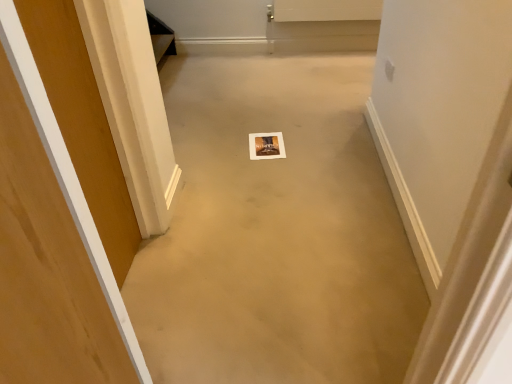
Question: Does beige carpet at center have a larger size compared to wooden door at left?

Choices:
 (A) yes
 (B) no

Answer: (A)

Question: Does beige carpet at center touch wooden door at left?

Choices:
 (A) no
 (B) yes

Answer: (A)

Question: Is wooden door at left located within beige carpet at center?

Choices:
 (A) no
 (B) yes

Answer: (A)

Question: From a real-world perspective, is beige carpet at center located beneath wooden door at left?

Choices:
 (A) yes
 (B) no

Answer: (A)

Question: Is the depth of beige carpet at center greater than that of wooden door at left?

Choices:
 (A) no
 (B) yes

Answer: (B)

Question: Is beige carpet at center taller than wooden door at left?

Choices:
 (A) no
 (B) yes

Answer: (A)

Question: Can you confirm if wooden door at left is shorter than beige carpet at center?

Choices:
 (A) no
 (B) yes

Answer: (A)

Question: Is wooden door at left positioned with its back to beige carpet at center?

Choices:
 (A) no
 (B) yes

Answer: (A)

Question: Would you say wooden door at left is outside beige carpet at center?

Choices:
 (A) yes
 (B) no

Answer: (A)

Question: Considering the relative sizes of wooden door at left and beige carpet at center in the image provided, is wooden door at left bigger than beige carpet at center?

Choices:
 (A) no
 (B) yes

Answer: (A)

Question: Is wooden door at left in contact with beige carpet at center?

Choices:
 (A) no
 (B) yes

Answer: (A)

Question: Does wooden door at left have a greater width compared to beige carpet at center?

Choices:
 (A) no
 (B) yes

Answer: (A)

Question: Is beige carpet at center wider or thinner than wooden door at left?

Choices:
 (A) wide
 (B) thin

Answer: (A)